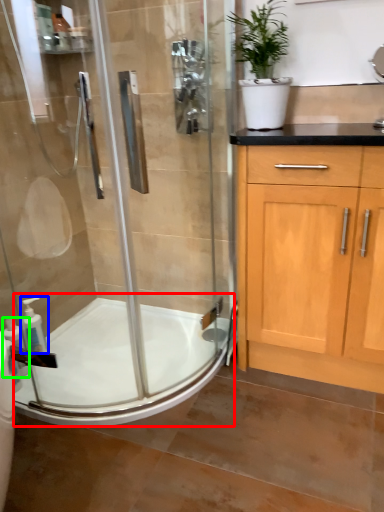
Question: Based on their relative distances, which object is farther from bath (highlighted by a red box)? Choose from soap dispenser (highlighted by a blue box) and soap dispenser (highlighted by a green box).

Choices:
 (A) soap dispenser
 (B) soap dispenser

Answer: (B)